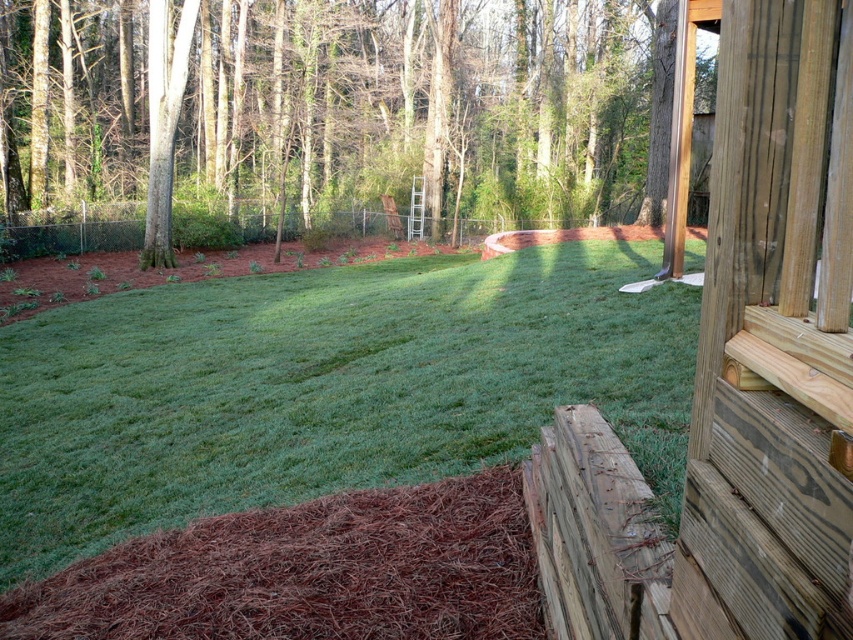
You are standing on the wooden deck and want to walk towards the brown wood tree at upper left and the weathered wood at lower right. Which object will you reach first?

You will reach the brown wood tree at upper left first because it is closer to you than the weathered wood at lower right, which is further away.

You are standing on the wooden deck and looking towards the brown wood tree at upper left. Can you see the weathered wood at lower right from this position?

The brown wood tree at upper left is above the weathered wood at lower right, so yes, you can see the weathered wood at lower right from your position on the deck because it is below the tree.

You are planning to place a large garden statue that requires a base area of 3 square meters. Based on the scene, which object between the brown wood tree at upper left and the weathered wood at lower right would provide a more stable and spacious foundation for the statue?

The brown wood tree at upper left has a larger size compared to the weathered wood at lower right, so it would provide a more stable and spacious foundation for the statue.